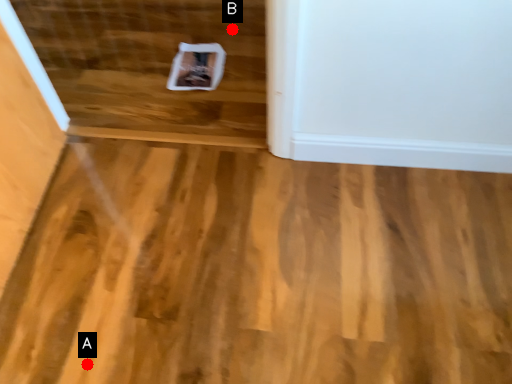
Question: Two points are circled on the image, labeled by A and B beside each circle. Which point is closer to the camera?

Choices:
 (A) A is closer
 (B) B is closer

Answer: (A)